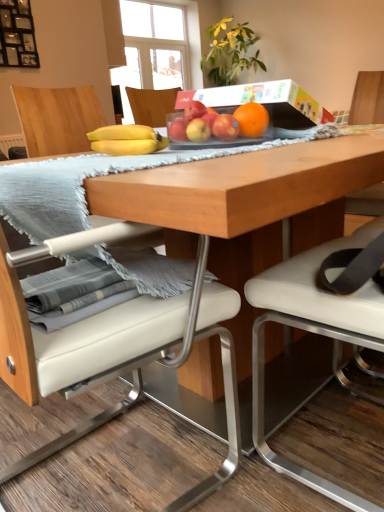
Question: Is the depth of white leather chair at center, marked as the 1th chair in a left-to-right arrangement, greater than that of red matte apple at center, placed as the second apple when sorted from left to right?

Choices:
 (A) no
 (B) yes

Answer: (A)

Question: Is white leather chair at center, placed as the second chair when sorted from right to left, in contact with red matte apple at center, arranged as the third apple when viewed from the right?

Choices:
 (A) no
 (B) yes

Answer: (A)

Question: Does white leather chair at center, marked as the 1th chair in a left-to-right arrangement, appear on the right side of red matte apple at center, arranged as the third apple when viewed from the right?

Choices:
 (A) no
 (B) yes

Answer: (A)

Question: Is white leather chair at center, placed as the second chair when sorted from right to left, at the left side of red matte apple at center, arranged as the third apple when viewed from the right?

Choices:
 (A) yes
 (B) no

Answer: (A)

Question: From the image's perspective, is white leather chair at center, placed as the second chair when sorted from right to left, below red matte apple at center, arranged as the third apple when viewed from the right?

Choices:
 (A) yes
 (B) no

Answer: (A)

Question: Considering the relative sizes of white leather chair at center, marked as the 1th chair in a left-to-right arrangement, and red matte apple at center, placed as the second apple when sorted from left to right, in the image provided, is white leather chair at center, marked as the 1th chair in a left-to-right arrangement, smaller than red matte apple at center, placed as the second apple when sorted from left to right,?

Choices:
 (A) no
 (B) yes

Answer: (A)

Question: Is white leather chair at center, the second chair in the left-to-right sequence, shorter than red matte apple at center, placed as the second apple when sorted from left to right?

Choices:
 (A) yes
 (B) no

Answer: (B)

Question: Considering the relative sizes of white leather chair at center, positioned as the first chair in right-to-left order, and red matte apple at center, placed as the second apple when sorted from left to right, in the image provided, is white leather chair at center, positioned as the first chair in right-to-left order, taller than red matte apple at center, placed as the second apple when sorted from left to right,?

Choices:
 (A) no
 (B) yes

Answer: (B)

Question: Is red matte apple at center, arranged as the third apple when viewed from the right, located within white leather chair at center, positioned as the first chair in right-to-left order?

Choices:
 (A) yes
 (B) no

Answer: (B)

Question: Is white leather chair at center, the second chair in the left-to-right sequence, outside red matte apple at center, placed as the second apple when sorted from left to right?

Choices:
 (A) no
 (B) yes

Answer: (B)

Question: From the image's perspective, does white leather chair at center, the second chair in the left-to-right sequence, appear lower than red matte apple at center, arranged as the third apple when viewed from the right?

Choices:
 (A) no
 (B) yes

Answer: (B)

Question: From the image's perspective, is white leather chair at center, the second chair in the left-to-right sequence, on top of red matte apple at center, placed as the second apple when sorted from left to right?

Choices:
 (A) no
 (B) yes

Answer: (A)

Question: Would you say yellow matte apple at center, which is counted as the 2th apple, starting from the right, is outside white leather chair at center, positioned as the first chair in right-to-left order?

Choices:
 (A) no
 (B) yes

Answer: (B)